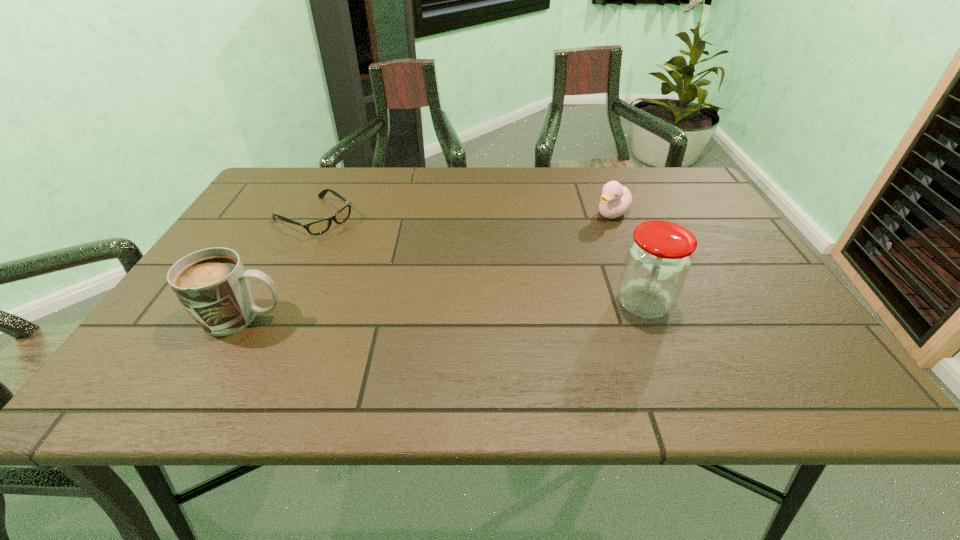
This screenshot has height=540, width=960. Find the location of `vacant region between the spectacles and the jar`. vacant region between the spectacles and the jar is located at coordinates (479, 261).

The image size is (960, 540). Find the location of `vacant space that is in between the second tallest object and the tallest object`. vacant space that is in between the second tallest object and the tallest object is located at coordinates (444, 310).

This screenshot has height=540, width=960. In order to click on free point between the spectacles and the second tallest object in this screenshot , I will do (x=278, y=268).

The image size is (960, 540). I want to click on empty space between the third shortest object and the third tallest object, so click(427, 265).

At what (x,y) coordinates should I click in order to perform the action: click on unoccupied position between the mug and the duckling. Please return your answer as a coordinate pair (x, y). Looking at the image, I should click on (427, 265).

Where is `object that stands as the closest to the jar`? Image resolution: width=960 pixels, height=540 pixels. object that stands as the closest to the jar is located at coordinates (615, 200).

The width and height of the screenshot is (960, 540). I want to click on object that ranks as the second closest to the second shortest object, so point(318,227).

The height and width of the screenshot is (540, 960). I want to click on vacant point that satisfies the following two spatial constraints: 1. on the front side of the jar; 2. on the right side of the spectacles, so click(x=270, y=303).